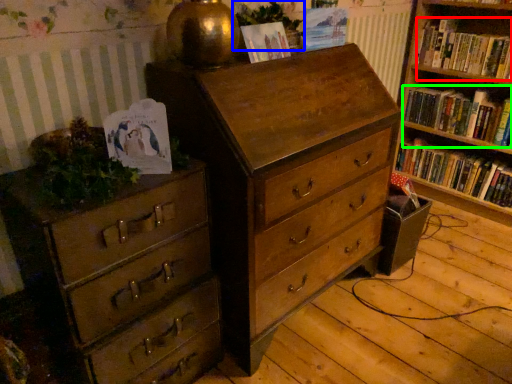
Question: Which object is the closest to the book (highlighted by a red box)? Choose among these: plant (highlighted by a blue box) or book (highlighted by a green box).

Choices:
 (A) plant
 (B) book

Answer: (B)